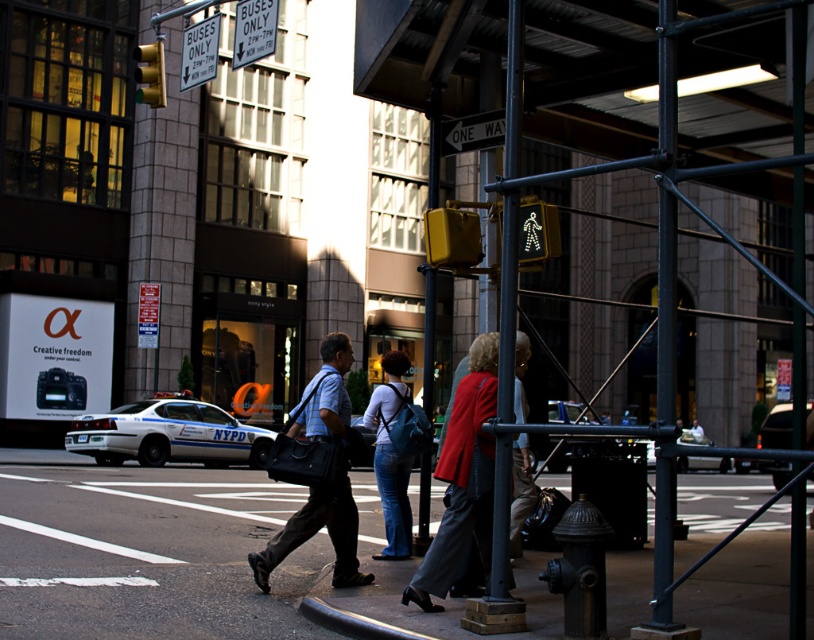
Question: Which is nearer to the dark gray metal fire hydrant at lower right?

Choices:
 (A) denim jeans at center
 (B) concrete sidewalk at center
 (C) matte red coat at center

Answer: (C)

Question: Estimate the real-world distances between objects in this image. Which object is farther from the matte red coat at center?

Choices:
 (A) concrete sidewalk at center
 (B) matte black bag at center
 (C) black metal pole at center
 (D) dark gray metal fire hydrant at lower right

Answer: (A)

Question: Among these points, which one is nearest to the camera?

Choices:
 (A) (462, 420)
 (B) (540, 579)
 (C) (392, 396)
 (D) (554, 614)

Answer: (B)

Question: From the image, what is the correct spatial relationship of white glossy police car at lower left in relation to denim jeans at center?

Choices:
 (A) above
 (B) below

Answer: (B)

Question: Is matte black bag at center to the left of dark gray metal fire hydrant at lower right from the viewer's perspective?

Choices:
 (A) yes
 (B) no

Answer: (A)

Question: Is concrete sidewalk at center positioned in front of matte red coat at center?

Choices:
 (A) yes
 (B) no

Answer: (A)